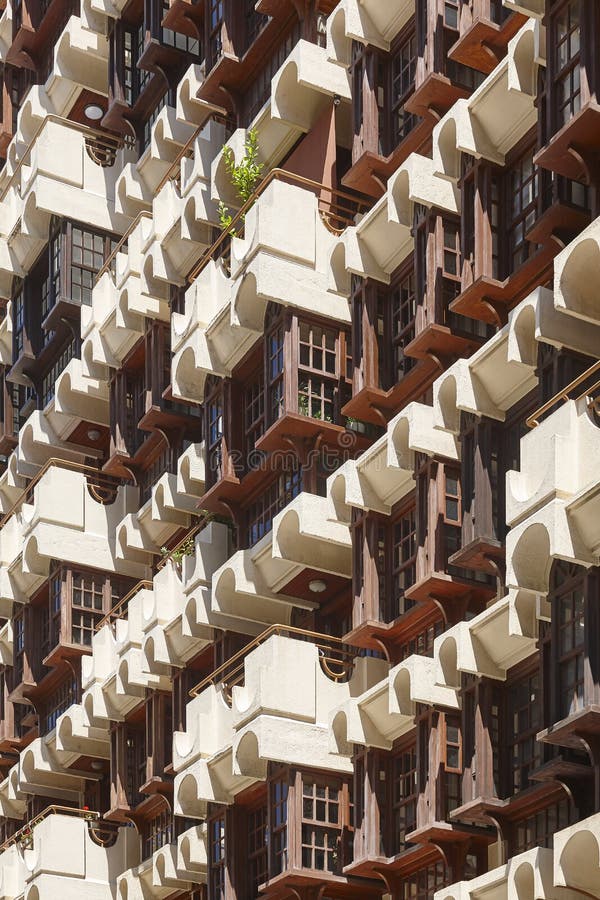
You are a GUI agent. You are given a task and a screenshot of the screen. Output one action in this format:
    pyautogui.click(x=<x>, y=<y>)
    Task: Click on the doors
    
    Given the screenshot: What is the action you would take?
    pyautogui.click(x=249, y=860), pyautogui.click(x=136, y=72)